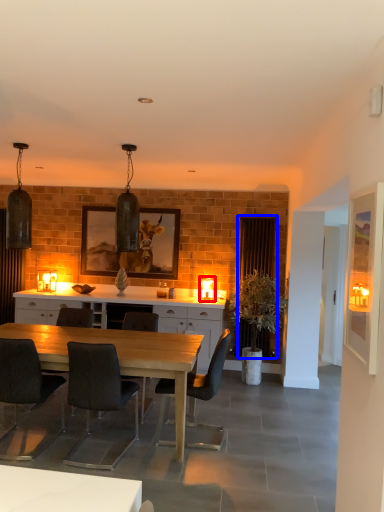
Question: Which of the following is the closest to the observer, lamp (highlighted by a red box) or curtain (highlighted by a blue box)?

Choices:
 (A) lamp
 (B) curtain

Answer: (B)